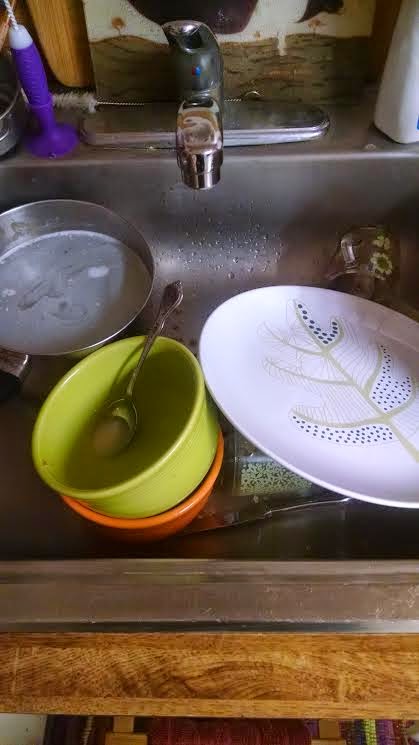
Identify the location of purple cleaning dish item handle. (43, 100).